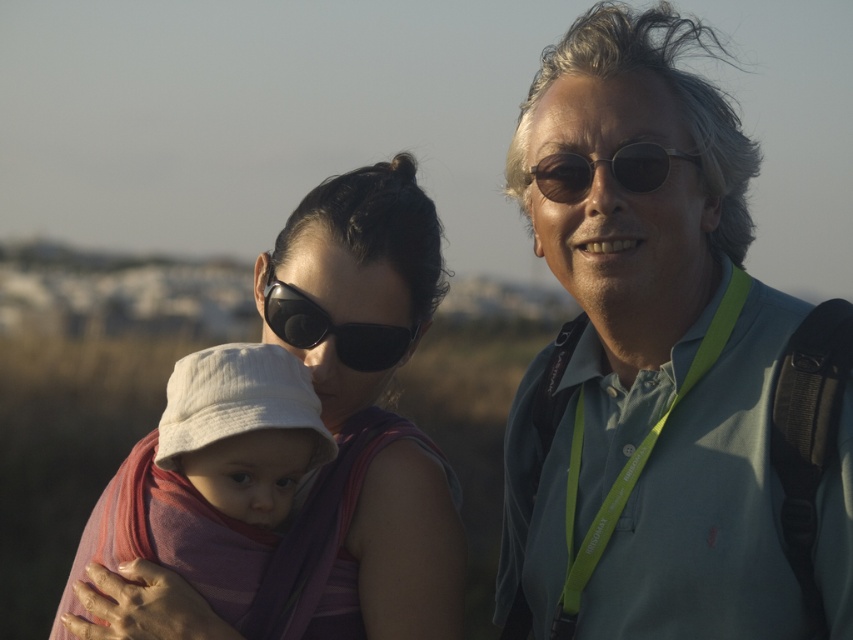
You are a photographer taking a picture of the matte purple fabric at center and the black matte sunglasses at center. Which object should you focus on if you want to capture the larger one in your shot?

The matte purple fabric at center is bigger than the black matte sunglasses at center, so you should focus on the matte purple fabric at center to capture the larger one in your shot.

You are a photographer taking a portrait of the two objects in the scene. The matte purple fabric at center and the black matte sunglasses at center are both in your frame. Where should you position your camera to ensure both objects are centered and aligned properly?

A: Position the camera so that the matte purple fabric at center is to the right of the black matte sunglasses at center, as the matte purple fabric at center is located to the right of the black matte sunglasses at center in the scene.